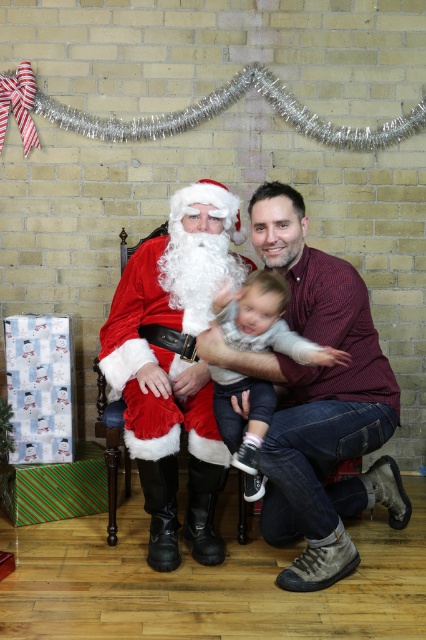
You are standing in front of a holiday photo and notice two people wearing different colored clothing. The first person is wearing a matte red shirt at center, and the second is wearing a soft gray sweater at center. Which piece of clothing is closer to you?

The matte red shirt at center is closer to you because it is further to the viewer than the soft gray sweater at center.

You are a photographer trying to capture a photo of the fuzzy red santa at left and the soft gray sweater at center. Based on their positions, which one is higher in the image?

The fuzzy red santa at left is located above the soft gray sweater at center, so the fuzzy red santa at left is higher in the image.